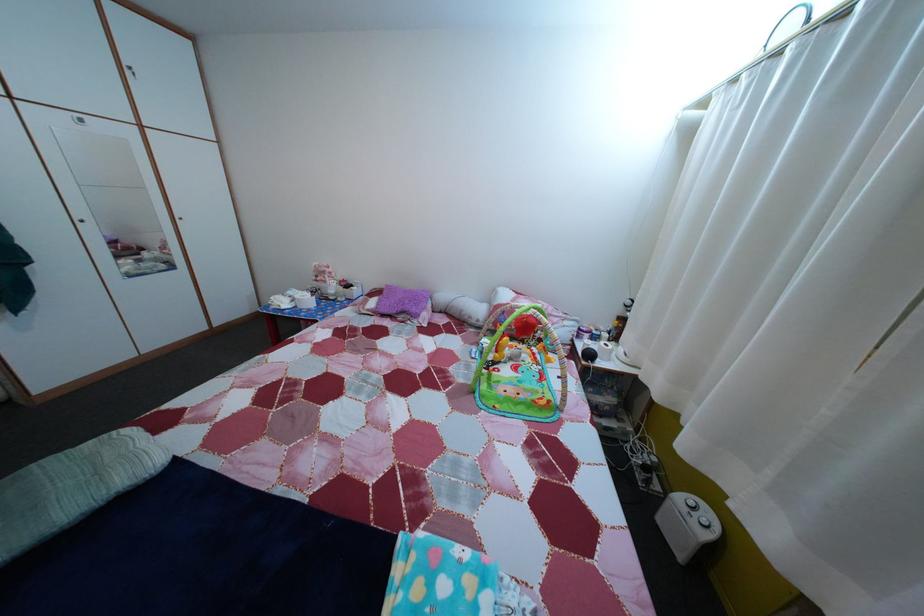
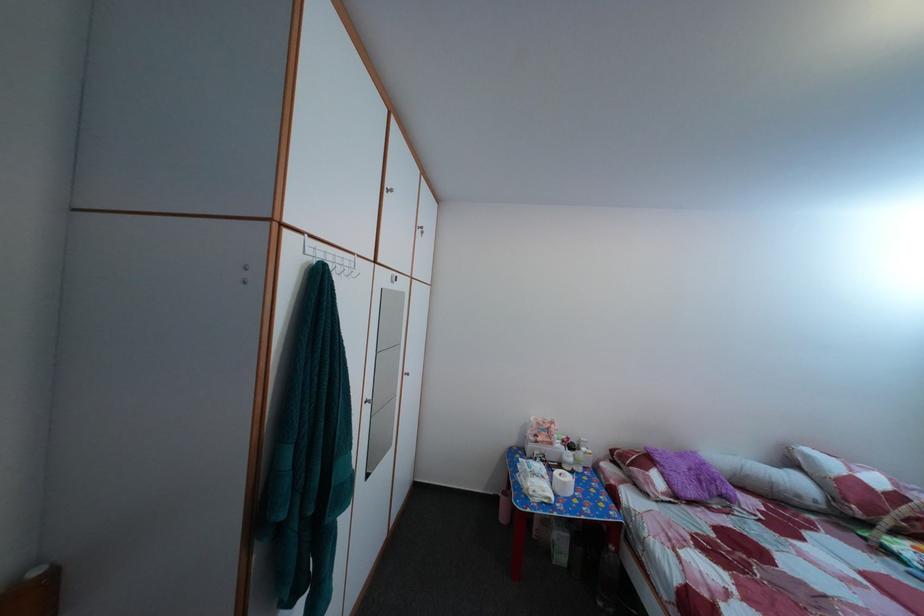
In the second image, find the point that corresponds to [416,299] in the first image.

(689, 464)